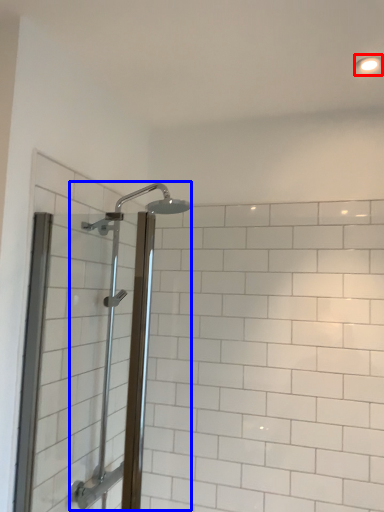
Question: Which object is closer to the camera taking this photo, light fixture (highlighted by a red box) or shower (highlighted by a blue box)?

Choices:
 (A) light fixture
 (B) shower

Answer: (B)